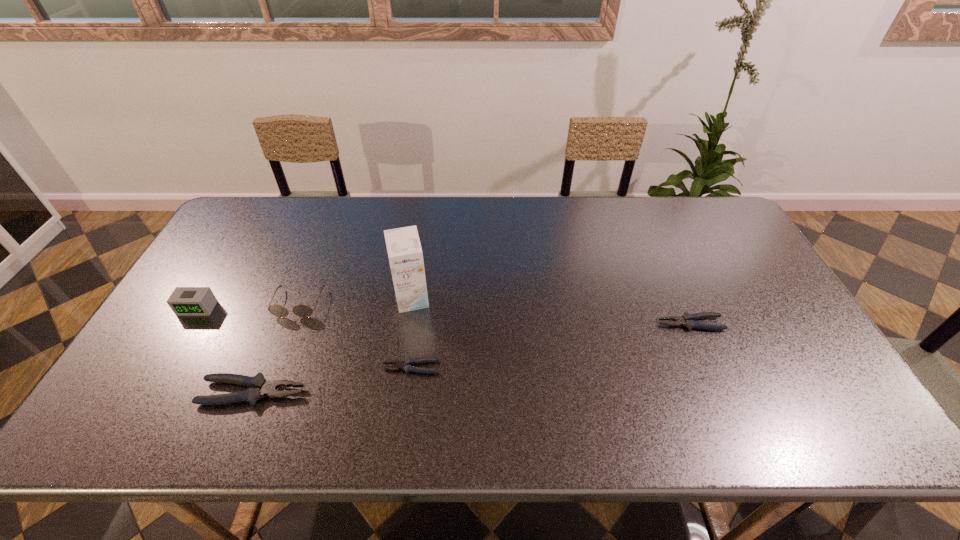
You are a GUI agent. You are given a task and a screenshot of the screen. Output one action in this format:
    pyautogui.click(x=<x>, y=<y>)
    Task: Click on the vacant position located at the gripping part of the second pliers from right to left
    
    Given the screenshot: What is the action you would take?
    pyautogui.click(x=296, y=367)

Find the location of `vacant area situated at the gripping part of the second pliers from right to left`. vacant area situated at the gripping part of the second pliers from right to left is located at coordinates (244, 367).

The image size is (960, 540). What are the coordinates of `vacant region located 0.130m at the gripping part of the second pliers from right to left` in the screenshot? It's located at (331, 367).

At what (x,y) coordinates should I click in order to perform the action: click on vacant space located at the gripping part of the rightmost pliers. Please return your answer as a coordinate pair (x, y). Looking at the image, I should click on (563, 323).

You are a GUI agent. You are given a task and a screenshot of the screen. Output one action in this format:
    pyautogui.click(x=<x>, y=<y>)
    Task: Click on the free space located at the gripping part of the rightmost pliers
    The image size is (960, 540).
    Given the screenshot: What is the action you would take?
    pos(585,323)

You are a GUI agent. You are given a task and a screenshot of the screen. Output one action in this format:
    pyautogui.click(x=<x>, y=<y>)
    Task: Click on the free space located 0.200m at the gripping part of the rightmost pliers
    This screenshot has width=960, height=540.
    Given the screenshot: What is the action you would take?
    pyautogui.click(x=585, y=323)

Image resolution: width=960 pixels, height=540 pixels. I want to click on blank space located on the front-facing side of the alarm clock, so click(159, 372).

At what (x,y) coordinates should I click in order to perform the action: click on vacant space located 0.070m on the lenses of the sunglasses. Please return your answer as a coordinate pair (x, y). Looking at the image, I should click on (285, 339).

The width and height of the screenshot is (960, 540). In order to click on vacant space positioned 0.140m on the back of the tallest object in this screenshot , I will do `click(419, 255)`.

Locate an element on the screen. The height and width of the screenshot is (540, 960). object positioned at the left edge is located at coordinates (184, 301).